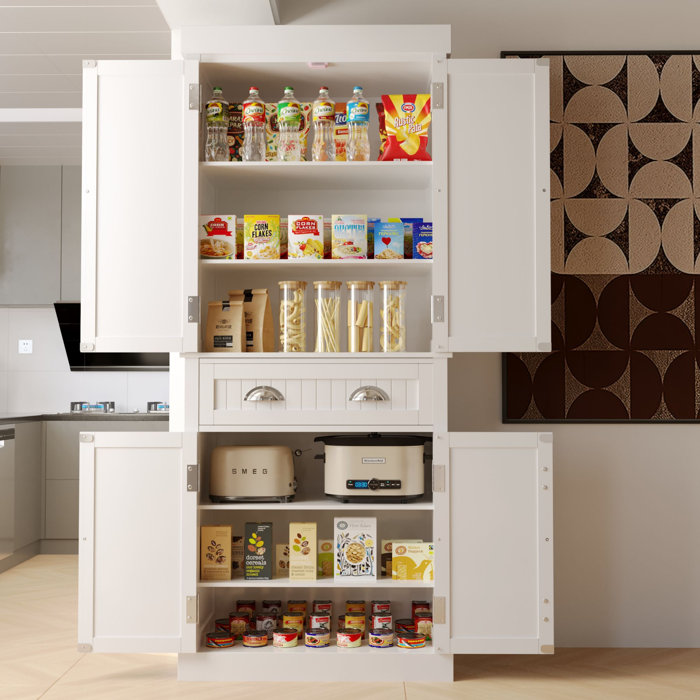
Identify the location of inside door hinges of cabinet. This screenshot has height=700, width=700. (441, 94), (435, 301), (190, 302), (188, 94), (190, 480), (189, 612), (435, 477), (435, 612).